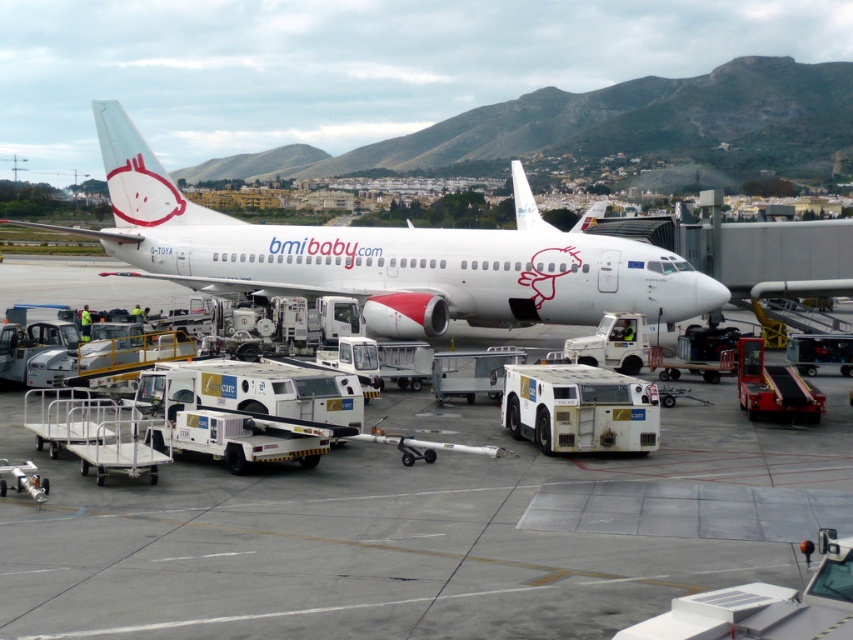
You are standing at the jet bridge observing the aircraft. There are two points marked on the plane, one at coordinates point (358,540) and the other at point (450,288). Which point is closer to your current position?

The point at (358,540) is closer to your current position because it is closer to the camera than point (450,288).

From the picture: You are a maintenance worker needing to reach the white matte airplane at center from your current position on the white rubber tarmac at center. Can you walk directly to the airplane without needing to detour around any obstacles?

The distance between the white rubber tarmac at center and the white matte airplane at center is 26.75 feet. Since there are no obstacles mentioned in the scene description, you can walk directly to the airplane without detouring.

You are standing at the center of the airport tarmac and want to walk to the jet bridge. According to the image, where is the white rubber tarmac at center located relative to your current position?

The white rubber tarmac at center is located at point (424, 531) in the image, so it is directly in front of you at the center of the tarmac.